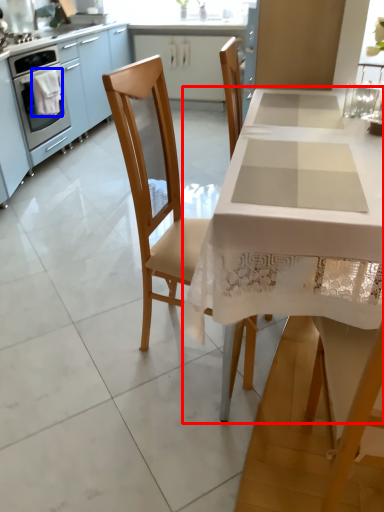
Question: Which point is closer to the camera, table (highlighted by a red box) or cloth (highlighted by a blue box)?

Choices:
 (A) table
 (B) cloth

Answer: (A)